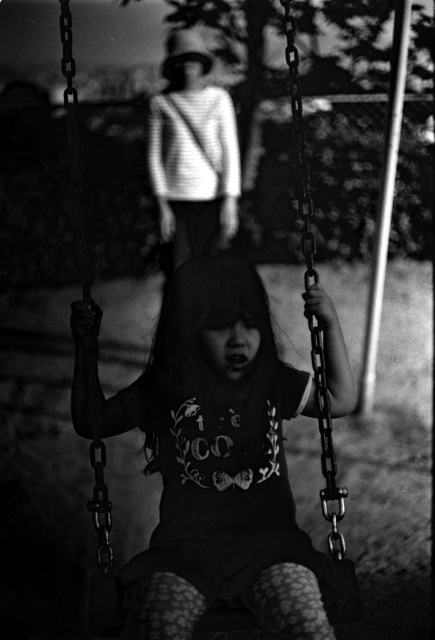
Question: Among these points, which one is nearest to the camera?

Choices:
 (A) (184, 184)
 (B) (200, 504)

Answer: (B)

Question: Which point is farther from the camera taking this photo?

Choices:
 (A) (253, 484)
 (B) (194, 33)

Answer: (B)

Question: Does dark fabric shirt at center have a greater width compared to striped sweater at upper center?

Choices:
 (A) yes
 (B) no

Answer: (A)

Question: Considering the relative positions of dark fabric shirt at center and striped sweater at upper center in the image provided, where is dark fabric shirt at center located with respect to striped sweater at upper center?

Choices:
 (A) left
 (B) right

Answer: (B)

Question: Can you confirm if dark fabric shirt at center is positioned below striped sweater at upper center?

Choices:
 (A) no
 (B) yes

Answer: (B)